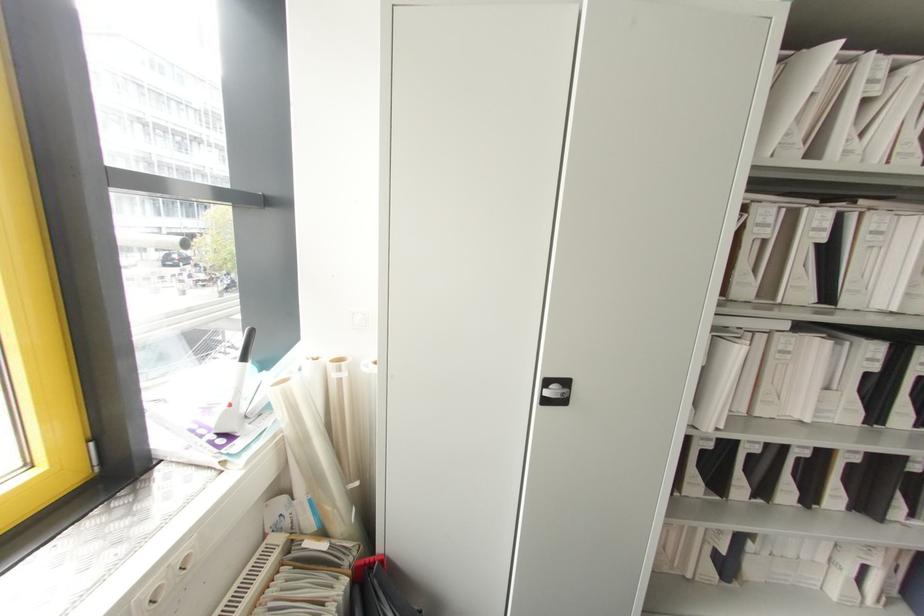
Locate an element on the screen. Image resolution: width=924 pixels, height=616 pixels. black tool handle is located at coordinates (239, 386).